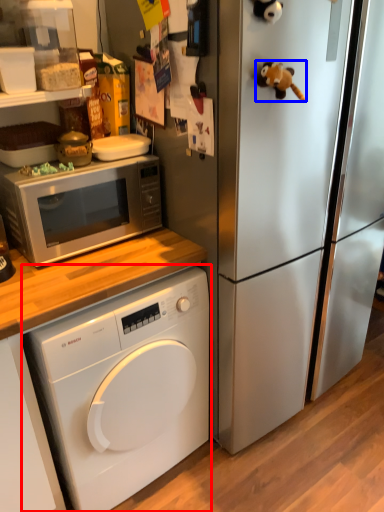
Question: Which object is closer to the camera taking this photo, washing machine (highlighted by a red box) or toy (highlighted by a blue box)?

Choices:
 (A) washing machine
 (B) toy

Answer: (B)